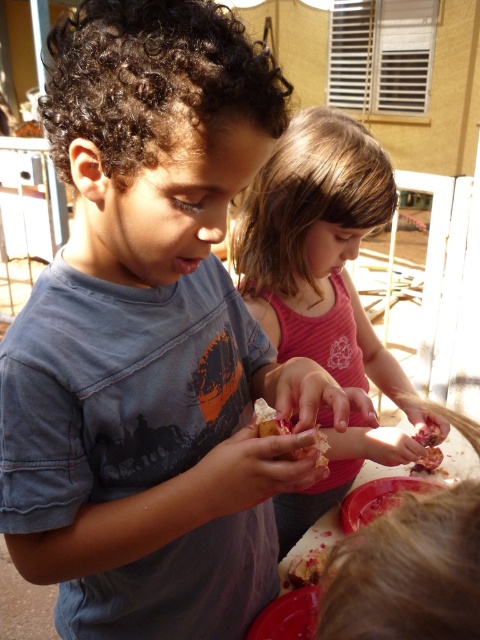
You are a photographer trying to capture a clear shot of the pink glossy fruit at center without the pink cotton shirt at center blocking it. Based on their positions, is this possible?

The pink cotton shirt at center is in front of the pink glossy fruit at center, so it is blocking the view. To capture a clear shot of the pink glossy fruit at center, you would need to adjust the angle or move the shirt out of the way.

Please provide the coordinates of the pink cotton shirt at center in the image. The scene includes two children working at a table with red plates, and the child on the right wears a pink sleeveless top.

The pink cotton shirt at center is located at coordinates point (317, 248).